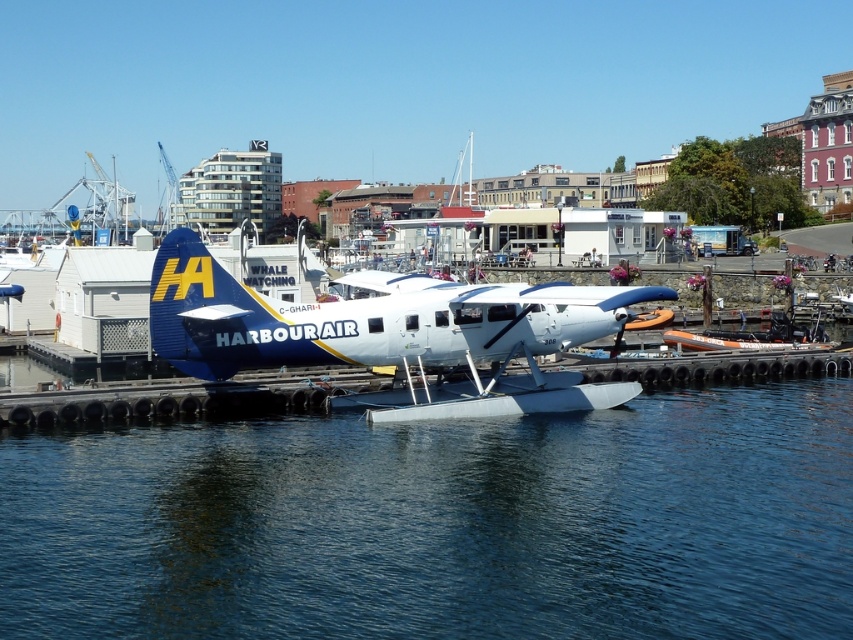
Question: Which of the following is the closest to the observer?

Choices:
 (A) (28, 576)
 (B) (206, 262)

Answer: (A)

Question: Which object appears closest to the camera in this image?

Choices:
 (A) blue matte seaplane at center
 (B) blue water at center

Answer: (B)

Question: Can you confirm if blue water at center is smaller than blue matte seaplane at center?

Choices:
 (A) no
 (B) yes

Answer: (B)

Question: Among these points, which one is nearest to the camera?

Choices:
 (A) (247, 513)
 (B) (519, 332)

Answer: (A)

Question: Can you confirm if blue water at center is bigger than blue matte seaplane at center?

Choices:
 (A) no
 (B) yes

Answer: (A)

Question: Does blue water at center have a smaller size compared to blue matte seaplane at center?

Choices:
 (A) no
 (B) yes

Answer: (B)